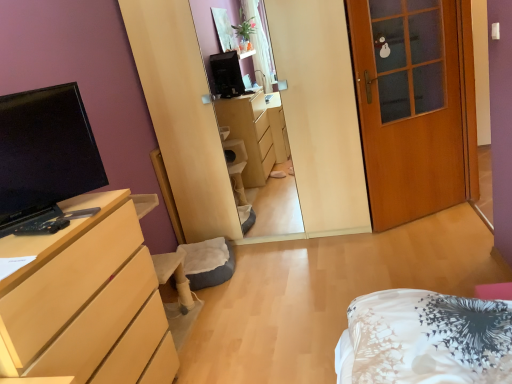
Question: Should I look upward or downward to see matte black tv at left?

Choices:
 (A) up
 (B) down

Answer: (A)

Question: Is light wood/finish dresser at left surrounding matte black tv at left?

Choices:
 (A) no
 (B) yes

Answer: (A)

Question: From the image's perspective, does light wood/finish dresser at left appear higher than matte black tv at left?

Choices:
 (A) no
 (B) yes

Answer: (A)

Question: Considering the relative sizes of light wood/finish dresser at left and matte black tv at left in the image provided, is light wood/finish dresser at left thinner than matte black tv at left?

Choices:
 (A) no
 (B) yes

Answer: (A)

Question: Could you tell me if light wood/finish dresser at left is turned towards matte black tv at left?

Choices:
 (A) no
 (B) yes

Answer: (A)

Question: Is light wood/finish dresser at left bigger than matte black tv at left?

Choices:
 (A) no
 (B) yes

Answer: (B)

Question: Can you confirm if light wood/finish dresser at left is taller than matte black tv at left?

Choices:
 (A) yes
 (B) no

Answer: (A)

Question: Would you say matte black tv at left is a long distance from light wood/finish dresser at left?

Choices:
 (A) yes
 (B) no

Answer: (B)

Question: Can you confirm if matte black tv at left is bigger than light wood/finish dresser at left?

Choices:
 (A) no
 (B) yes

Answer: (A)

Question: From a real-world perspective, is matte black tv at left on top of light wood/finish dresser at left?

Choices:
 (A) no
 (B) yes

Answer: (B)

Question: From the image's perspective, is matte black tv at left located beneath light wood/finish dresser at left?

Choices:
 (A) no
 (B) yes

Answer: (A)

Question: Is matte black tv at left thinner than light wood/finish dresser at left?

Choices:
 (A) yes
 (B) no

Answer: (A)

Question: Is light wood/finish dresser at left completely or partially inside matte black tv at left?

Choices:
 (A) yes
 (B) no

Answer: (B)

Question: From a real-world perspective, is light wood/finish dresser at left under wooden door at right?

Choices:
 (A) no
 (B) yes

Answer: (B)